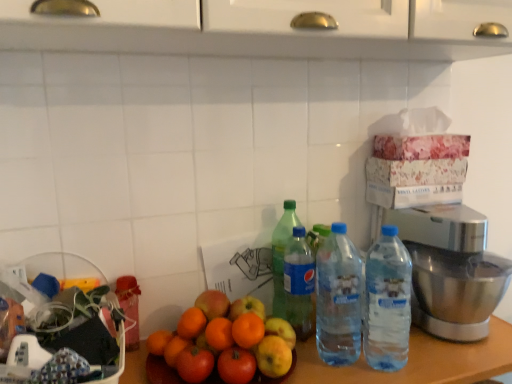
Find the location of a particular element. This screenshot has height=384, width=512. vacant area that is situated to the right of clear plastic water bottles at center-right, placed as the 4th bottle when sorted from left to right is located at coordinates (448, 357).